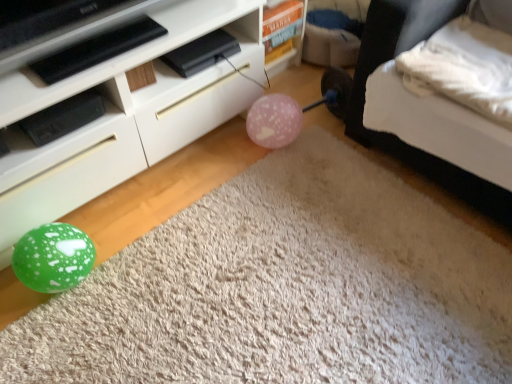
Locate an element on the screen. Image resolution: width=512 pixels, height=384 pixels. free space underneath green glossy balloon at lower left (from a real-world perspective) is located at coordinates (332, 326).